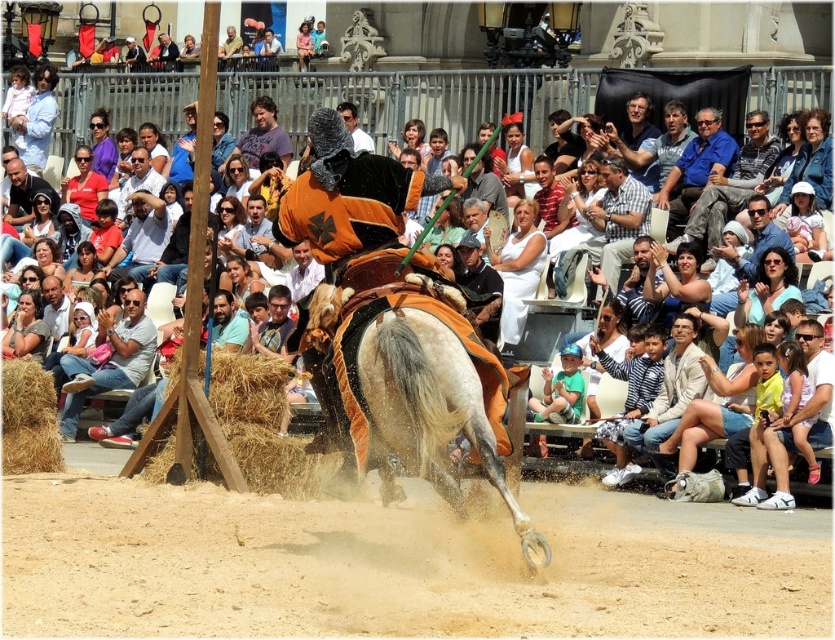
Question: Does blue denim jeans at upper right have a smaller size compared to light brown hair at center?

Choices:
 (A) yes
 (B) no

Answer: (A)

Question: Among these points, which one is nearest to the camera?

Choices:
 (A) (524, 225)
 (B) (749, 150)
 (C) (618, 252)
 (D) (48, 385)

Answer: (D)

Question: Which of the following is the closest to the observer?

Choices:
 (A) (105, 189)
 (B) (287, 442)

Answer: (B)

Question: Does white cotton clothing at center have a lesser width compared to matte red shirt at center?

Choices:
 (A) no
 (B) yes

Answer: (A)

Question: Is brown wooden hay at center to the left of matte white shirt at center from the viewer's perspective?

Choices:
 (A) no
 (B) yes

Answer: (A)

Question: Which point is farther to the camera?

Choices:
 (A) brown leather horse at center
 (B) brown dusty ground at lower center
 (C) matte black shirt at upper left
 (D) white cotton clothing at center

Answer: (C)